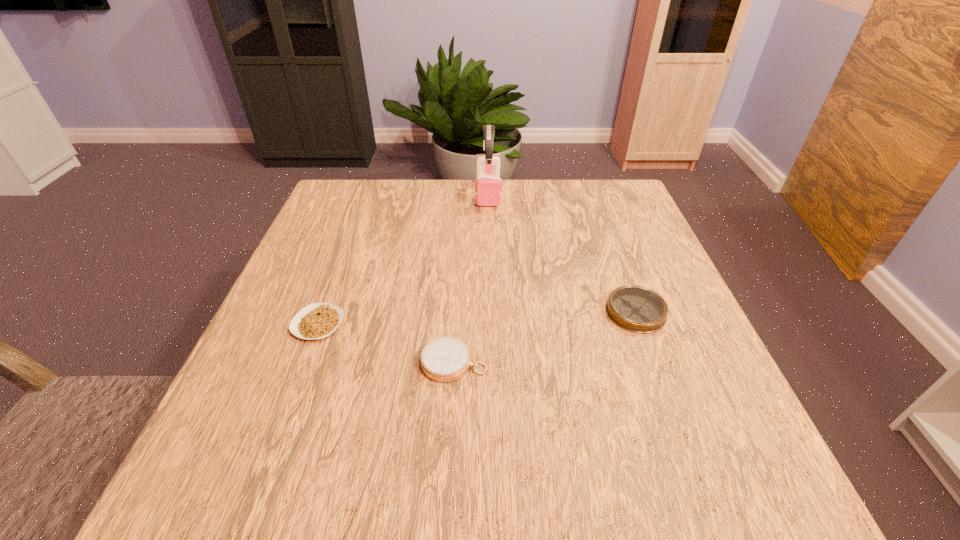
You are a GUI agent. You are given a task and a screenshot of the screen. Output one action in this format:
    pyautogui.click(x=<x>, y=<y>)
    Task: Click on the vacant space at the near right corner
    The image size is (960, 540).
    Given the screenshot: What is the action you would take?
    pyautogui.click(x=751, y=447)

The image size is (960, 540). In order to click on vacant region between the farther compass and the left compass in this screenshot , I will do `click(544, 337)`.

I want to click on empty location between the tallest object and the right compass, so click(562, 252).

Locate an element on the screen. The width and height of the screenshot is (960, 540). vacant region between the farther compass and the earphone is located at coordinates (562, 252).

Locate an element on the screen. The image size is (960, 540). empty location between the tallest object and the rightmost object is located at coordinates (562, 252).

Where is `vacant point located between the leftmost object and the right compass`? vacant point located between the leftmost object and the right compass is located at coordinates (477, 318).

At what (x,y) coordinates should I click in order to perform the action: click on unoccupied position between the right compass and the left compass. Please return your answer as a coordinate pair (x, y). This screenshot has height=540, width=960. Looking at the image, I should click on (544, 337).

Locate an element on the screen. Image resolution: width=960 pixels, height=540 pixels. vacant space that is in between the left compass and the legume is located at coordinates (386, 343).

I want to click on blank region between the earphone and the right compass, so click(x=562, y=252).

Locate an element on the screen. The width and height of the screenshot is (960, 540). vacant area between the leftmost object and the tallest object is located at coordinates (403, 259).